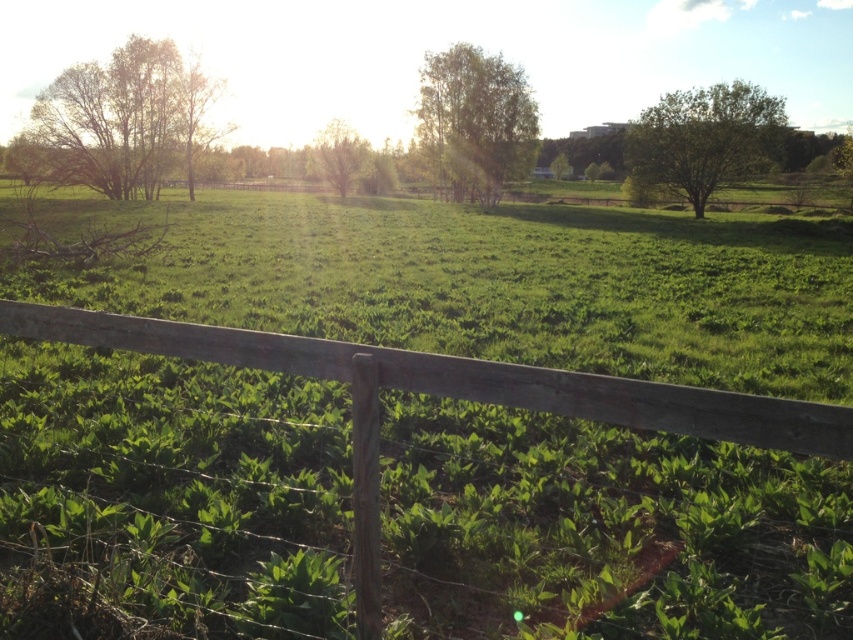
Between weathered wood fence at lower center and green leafy tree at upper right, which one has less height?

weathered wood fence at lower center

From the picture: Who is higher up, weathered wood fence at lower center or green leafy tree at upper right?

green leafy tree at upper right is higher up.

Is point (834, 417) positioned before point (675, 115)?

Yes, it is in front of point (675, 115).

Identify the location of weathered wood fence at lower center. The height and width of the screenshot is (640, 853). click(x=459, y=378).

The image size is (853, 640). Identify the location of weathered wood fence at lower center. (459, 378).

Does weathered wood fence at lower center appear on the left side of green leafy tree at upper center?

Indeed, weathered wood fence at lower center is positioned on the left side of green leafy tree at upper center.

Identify the location of weathered wood fence at lower center. (459, 378).

Where is `weathered wood fence at lower center`? The image size is (853, 640). weathered wood fence at lower center is located at coordinates (459, 378).

Is green leafy tree at upper center shorter than green leafy tree at center?

Incorrect, green leafy tree at upper center's height does not fall short of green leafy tree at center's.

This screenshot has height=640, width=853. Describe the element at coordinates (474, 122) in the screenshot. I see `green leafy tree at upper center` at that location.

Identify the location of green leafy tree at upper center. The width and height of the screenshot is (853, 640). (474, 122).